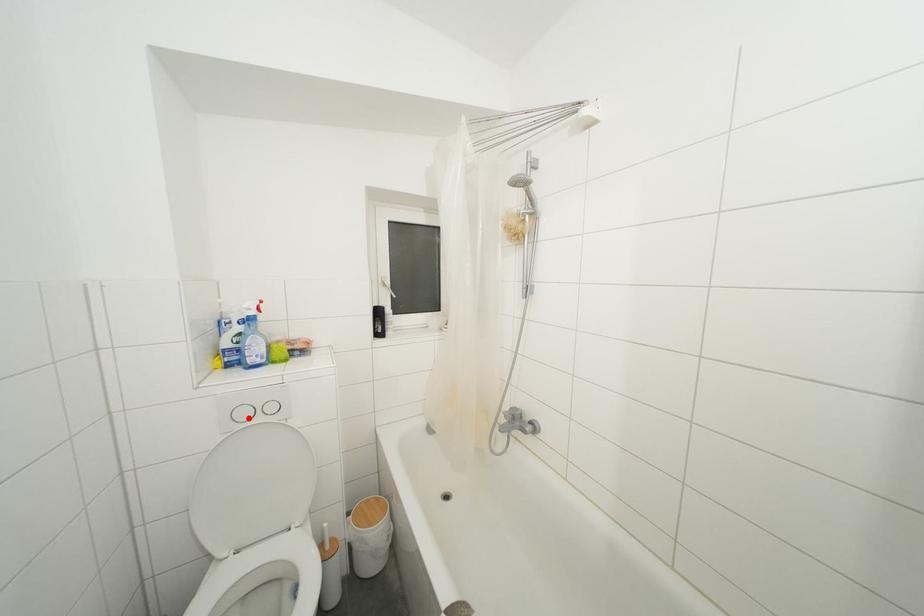
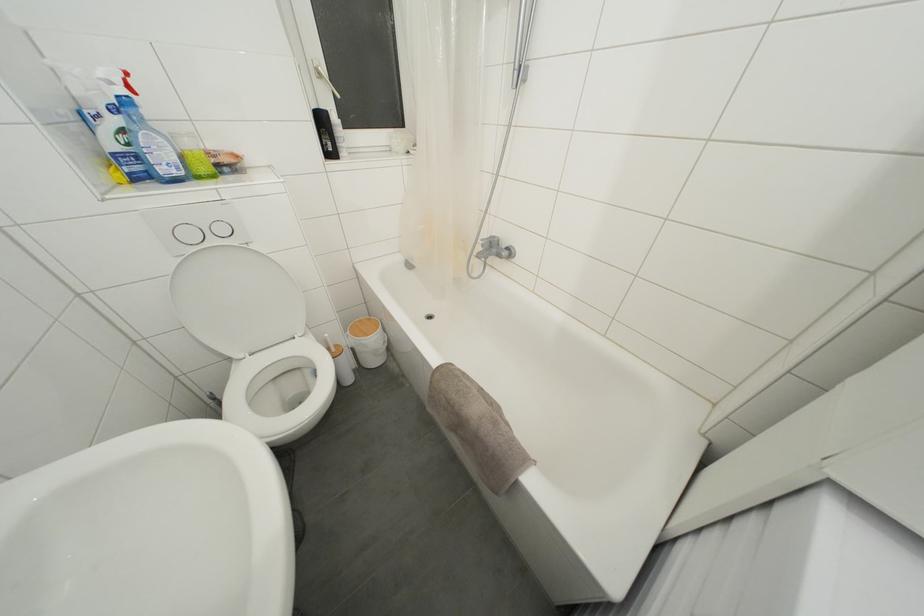
In the second image, find the point that corresponds to the highlighted location in the first image.

(195, 240)